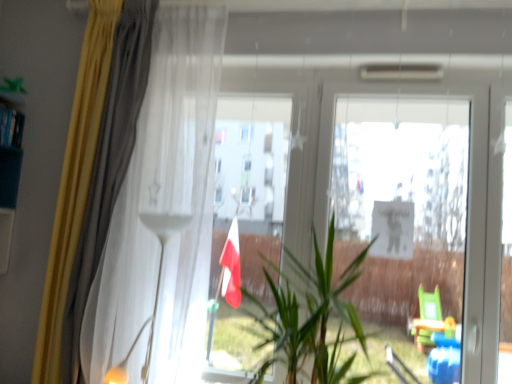
Question: Is white glossy floor lamp at upper center facing towards yellow fabric curtain at left, marked as the second curtain in a right-to-left arrangement?

Choices:
 (A) yes
 (B) no

Answer: (B)

Question: Is white glossy floor lamp at upper center next to yellow fabric curtain at left, marked as the second curtain in a right-to-left arrangement, and touching it?

Choices:
 (A) no
 (B) yes

Answer: (A)

Question: Considering the relative sizes of white glossy floor lamp at upper center and yellow fabric curtain at left, marked as the second curtain in a right-to-left arrangement, in the image provided, is white glossy floor lamp at upper center wider than yellow fabric curtain at left, marked as the second curtain in a right-to-left arrangement,?

Choices:
 (A) no
 (B) yes

Answer: (B)

Question: Is white glossy floor lamp at upper center at the right side of yellow fabric curtain at left, which is counted as the 1th curtain, starting from the left?

Choices:
 (A) yes
 (B) no

Answer: (A)

Question: Is white glossy floor lamp at upper center far away from yellow fabric curtain at left, marked as the second curtain in a right-to-left arrangement?

Choices:
 (A) yes
 (B) no

Answer: (B)

Question: From the image's perspective, is green leafy plant at center positioned above or below transparent glass screen door at right?

Choices:
 (A) above
 (B) below

Answer: (B)

Question: Looking at the image, does green leafy plant at center seem bigger or smaller compared to transparent glass screen door at right?

Choices:
 (A) small
 (B) big

Answer: (B)

Question: Is green leafy plant at center to the left or to the right of transparent glass screen door at right in the image?

Choices:
 (A) right
 (B) left

Answer: (B)

Question: Is point (290, 327) closer or farther from the camera than point (464, 266)?

Choices:
 (A) closer
 (B) farther

Answer: (A)

Question: From a real-world perspective, is white sheer curtain at left, the first curtain viewed from the right, positioned above or below white glossy floor lamp at upper center?

Choices:
 (A) below
 (B) above

Answer: (B)

Question: From the image's perspective, is white sheer curtain at left, acting as the second curtain starting from the left, located above or below white glossy floor lamp at upper center?

Choices:
 (A) above
 (B) below

Answer: (A)

Question: Looking at the image, does white sheer curtain at left, acting as the second curtain starting from the left, seem bigger or smaller compared to white glossy floor lamp at upper center?

Choices:
 (A) big
 (B) small

Answer: (A)

Question: Considering the positions of white sheer curtain at left, acting as the second curtain starting from the left, and white glossy floor lamp at upper center in the image, is white sheer curtain at left, acting as the second curtain starting from the left, wider or thinner than white glossy floor lamp at upper center?

Choices:
 (A) thin
 (B) wide

Answer: (A)

Question: Considering the positions of white glossy floor lamp at upper center and green leafy plant at center in the image, is white glossy floor lamp at upper center taller or shorter than green leafy plant at center?

Choices:
 (A) tall
 (B) short

Answer: (A)

Question: In the image, is white glossy floor lamp at upper center positioned in front of or behind green leafy plant at center?

Choices:
 (A) front
 (B) behind

Answer: (B)